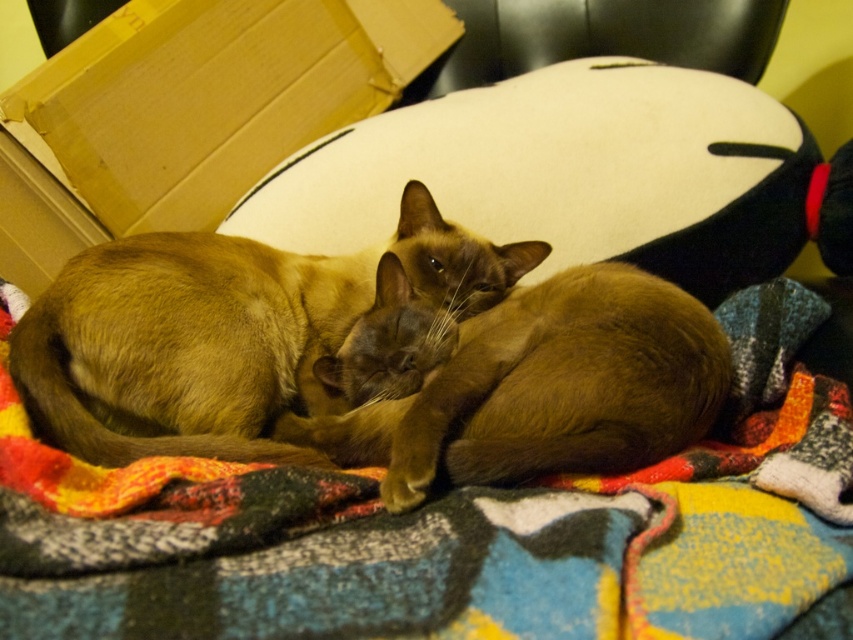
Question: Considering the real-world distances, which object is closest to the black leather chair at upper center?

Choices:
 (A) brown silky cat at center
 (B) multicolored woven blanket at center

Answer: (A)

Question: From the image, what is the correct spatial relationship of brown fur cat at center in relation to black leather chair at upper center?

Choices:
 (A) below
 (B) above

Answer: (A)

Question: Which of the following is the farthest from the observer?

Choices:
 (A) cardboard box at upper left
 (B) brown fur cat at center

Answer: (A)

Question: Where is brown silky cat at center located in relation to brown fur cat at center in the image?

Choices:
 (A) below
 (B) above

Answer: (B)

Question: Is brown silky cat at center above brown fur cat at center?

Choices:
 (A) yes
 (B) no

Answer: (A)

Question: Which point is closer to the camera?

Choices:
 (A) brown silky cat at center
 (B) multicolored woven blanket at center

Answer: (B)